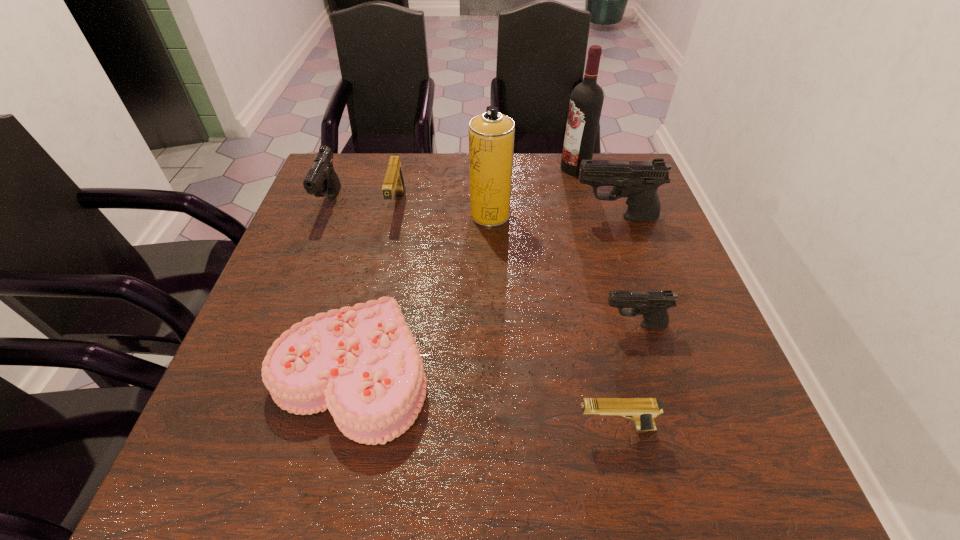
The image size is (960, 540). I want to click on the second nearest pistol, so click(x=653, y=305).

I want to click on the right tan pistol, so click(x=643, y=411).

Image resolution: width=960 pixels, height=540 pixels. What are the coordinates of `the nearest pistol` in the screenshot? It's located at (643, 411).

The height and width of the screenshot is (540, 960). I want to click on cake, so click(362, 363).

The width and height of the screenshot is (960, 540). In order to click on vacant space located on the label of the wine bottle in this screenshot , I will do `click(516, 168)`.

Image resolution: width=960 pixels, height=540 pixels. I want to click on free space located 0.290m on the label of the wine bottle, so click(463, 168).

You are a GUI agent. You are given a task and a screenshot of the screen. Output one action in this format:
    pyautogui.click(x=<x>, y=<y>)
    Task: Click on the vacant region located 0.340m on the label of the wine bottle
    
    Given the screenshot: What is the action you would take?
    pyautogui.click(x=446, y=168)

Where is `vacant space positioned on the left of the second tallest object`? The height and width of the screenshot is (540, 960). vacant space positioned on the left of the second tallest object is located at coordinates (390, 214).

Where is `vacant space positioned 0.330m at the barrel of the tallest pistol`? vacant space positioned 0.330m at the barrel of the tallest pistol is located at coordinates (444, 218).

This screenshot has width=960, height=540. In order to click on free space located 0.390m at the barrel of the tallest pistol in this screenshot , I will do `click(421, 218)`.